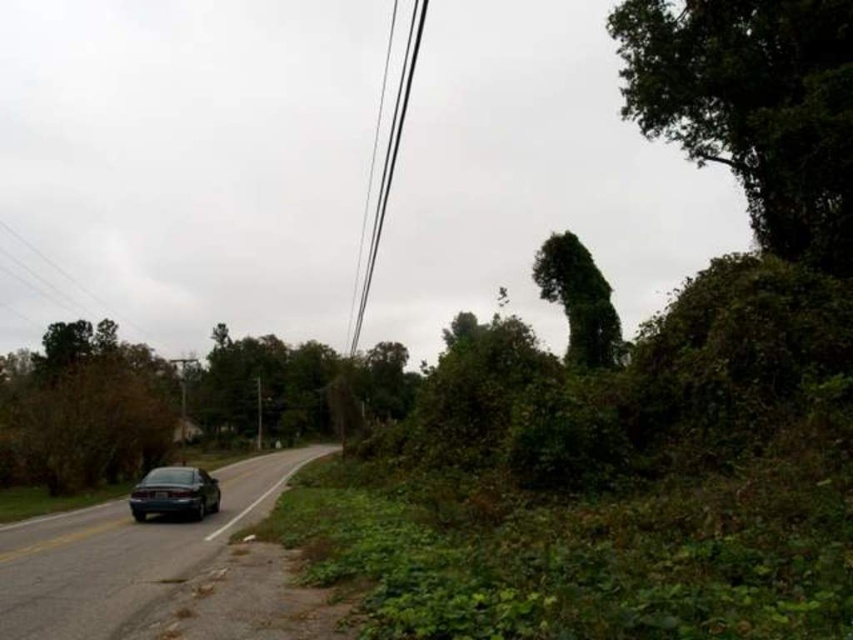
You are a pedestrian standing at the point labeled point (375, 208). A car is traveling away from you on the left side of the road. If the car is moving at 30 mph, how long will it take for the car to reach a point 3335.61 feet ahead of its current position?

The car is moving at 30 mph, which converts to approximately 44 feet per second. To cover 3335.61 feet, it would take about 3335.61 divided by 44, which is roughly 75.8 seconds, or about 1 minute and 16 seconds.

You are a driver approaching the road in the image. You notice a green leafy tree at left and a black wire at upper center. Which object is wider from your perspective?

The green leafy tree at left is wider than the black wire at upper center.

You are a delivery driver approaching the road shown in the image. You notice the green leafy tree at upper right and the black wire at upper center. Which object is closer to the road?

The green leafy tree at upper right is closer to the road because it is positioned below the black wire at upper center, indicating it is lower and nearer to the road level compared to the wire which is higher up.